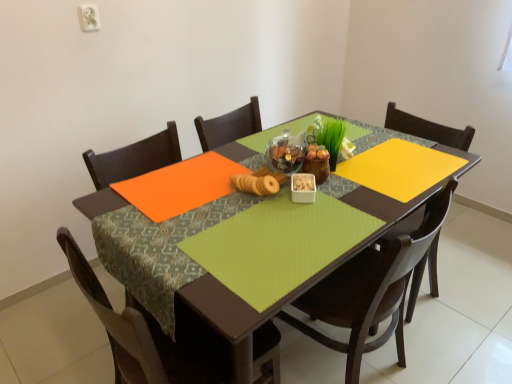
Question: Considering the positions of brown wood chair at lower left, which ranks as the 1th chair in left-to-right order, and white plastic container at center in the image, is brown wood chair at lower left, which ranks as the 1th chair in left-to-right order, taller or shorter than white plastic container at center?

Choices:
 (A) tall
 (B) short

Answer: (A)

Question: Is point (90, 289) positioned closer to the camera than point (307, 200)?

Choices:
 (A) farther
 (B) closer

Answer: (B)

Question: Which of these objects is positioned farthest from the matte wood chair at center, the second chair from the left?

Choices:
 (A) matte brown cookies at center
 (B) white plastic container at center
 (C) green fabric table at center
 (D) brown wood chair at lower left, the second chair in the right-to-left sequence

Answer: (A)

Question: Based on their relative distances, which object is farther from the brown wood chair at lower left, the second chair in the right-to-left sequence?

Choices:
 (A) matte brown cookies at center
 (B) matte wood chair at center, the second chair from the left
 (C) white plastic container at center
 (D) green fabric table at center

Answer: (C)